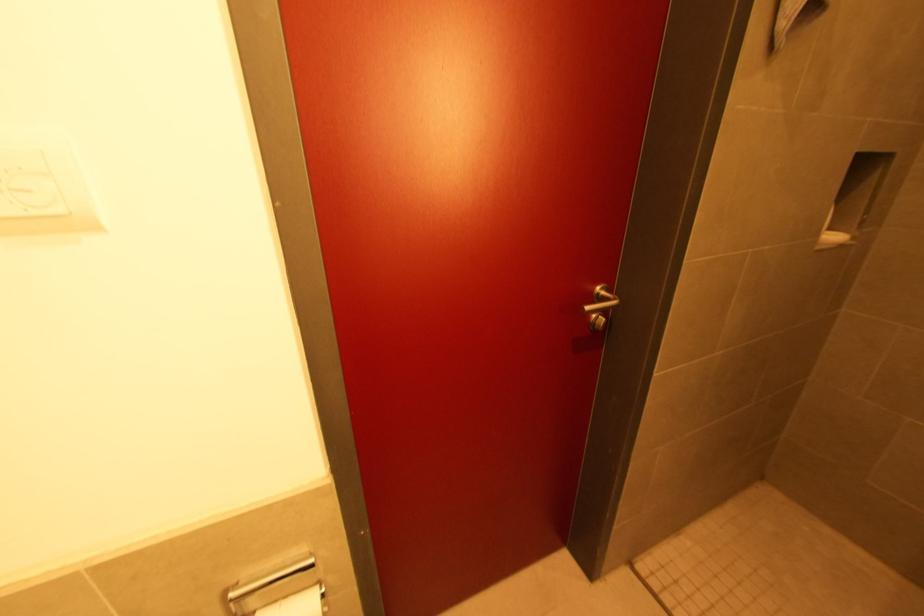
The height and width of the screenshot is (616, 924). Describe the element at coordinates (602, 326) in the screenshot. I see `the silver door lock` at that location.